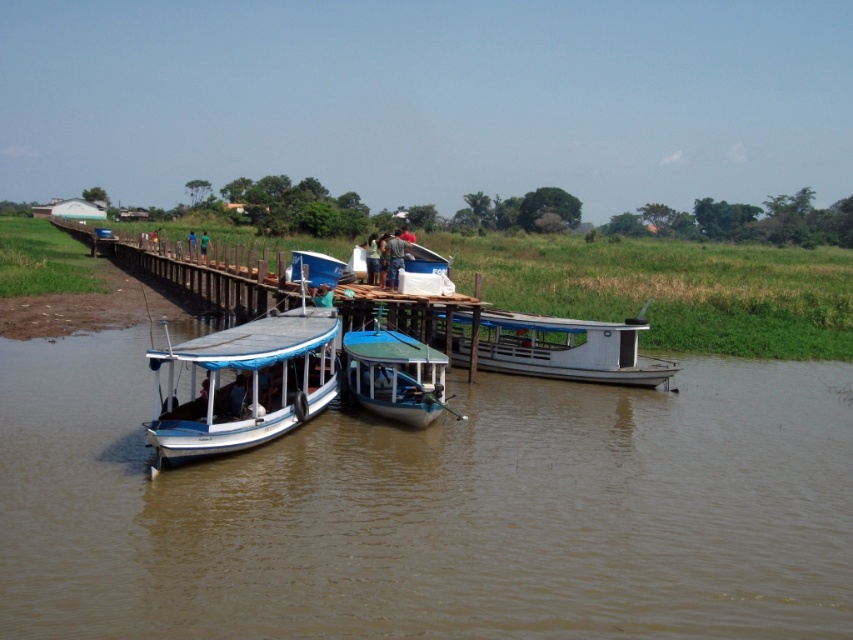
Can you confirm if brown muddy water at center is positioned above brown fabric bag at center?

Actually, brown muddy water at center is below brown fabric bag at center.

Image resolution: width=853 pixels, height=640 pixels. Describe the element at coordinates (431, 509) in the screenshot. I see `brown muddy water at center` at that location.

Is point (138, 330) more distant than point (399, 257)?

Yes, point (138, 330) is behind point (399, 257).

The image size is (853, 640). I want to click on brown muddy water at center, so click(431, 509).

Which is more to the right, brown muddy water at center or teal glossy boat at center?

Positioned to the right is teal glossy boat at center.

Can you confirm if brown muddy water at center is wider than teal glossy boat at center?

Correct, the width of brown muddy water at center exceeds that of teal glossy boat at center.

Is point (303, 456) in front of point (418, 401)?

Yes, point (303, 456) is closer to viewer.

Find the location of a particular element. The image size is (853, 640). brown muddy water at center is located at coordinates (431, 509).

Can you confirm if wooden dock at center is taller than green fabric person at center?

Yes.

Does point (427, 323) come behind point (192, 237)?

That is False.

Between point (471, 348) and point (189, 234), which one is positioned behind?

Positioned behind is point (189, 234).

Where is `wooden dock at center`? The height and width of the screenshot is (640, 853). wooden dock at center is located at coordinates (102, 243).